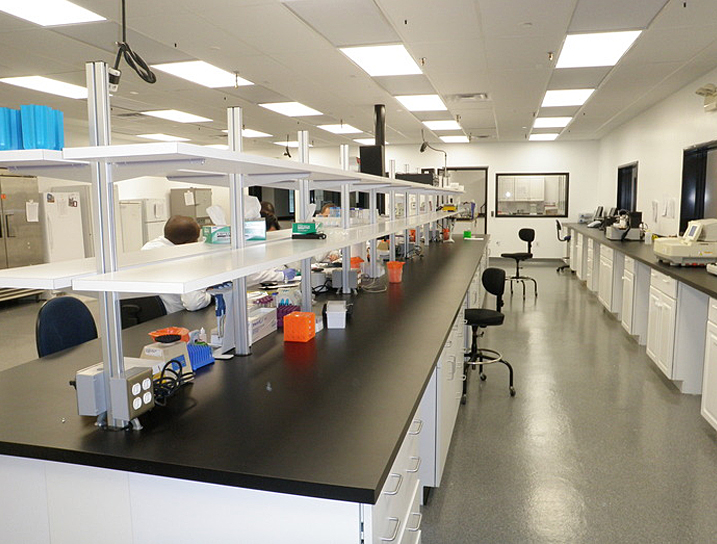
Locate an element on the screen. electrical outlet is located at coordinates (138, 389).